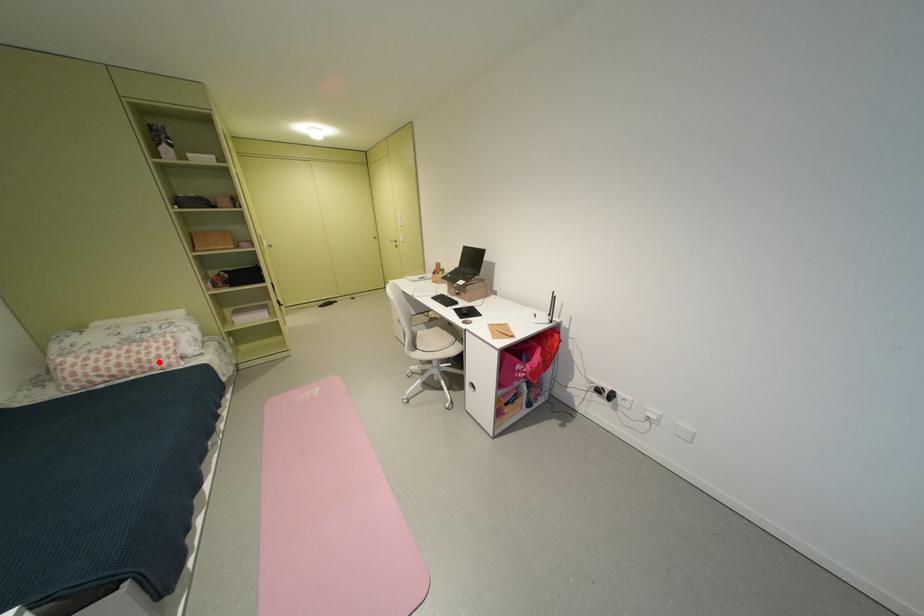
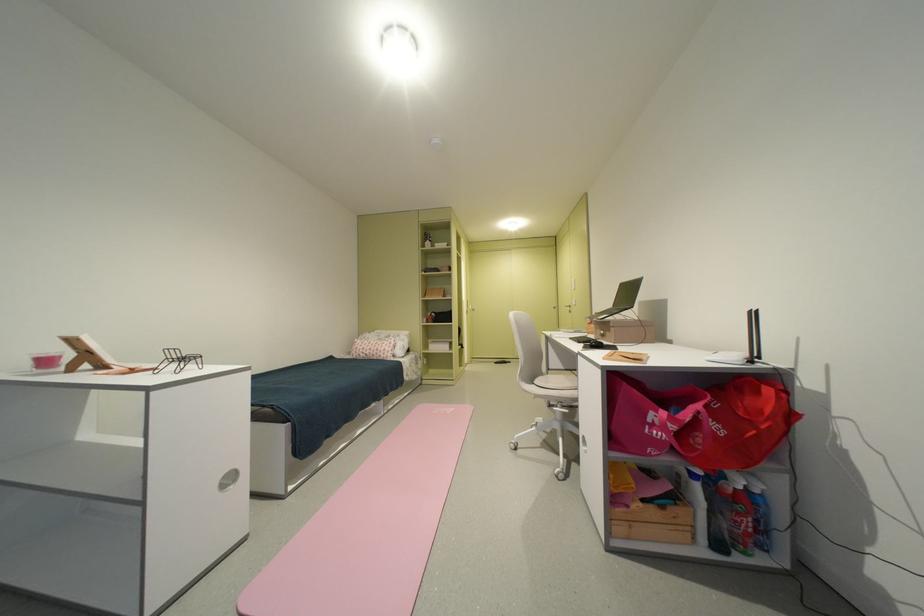
Question: I am providing you with two images of the same scene from different viewpoints. A red point is shown in image1. For the corresponding object point in image2, is it positioned nearer or farther from the camera?

Choices:
 (A) Nearer
 (B) Farther

Answer: (B)